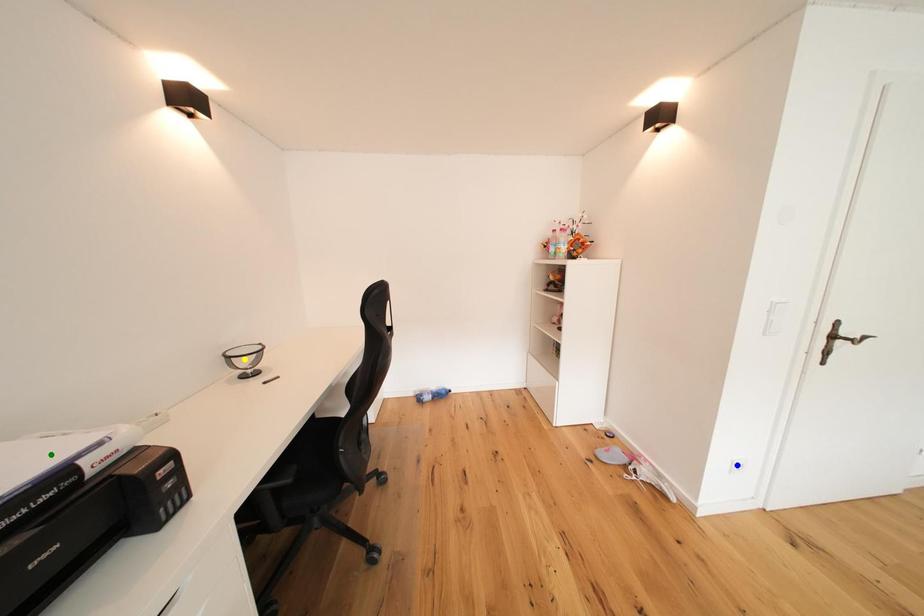
Order these from nearest to farthest:
- yellow point
- green point
- blue point

yellow point
blue point
green point